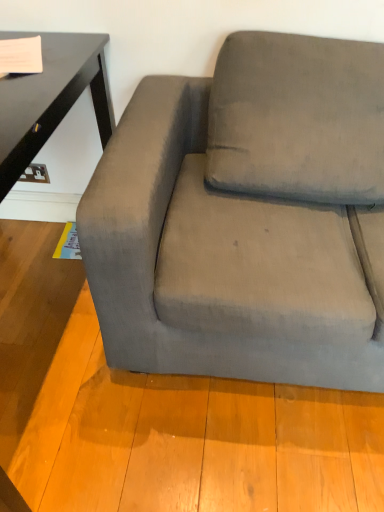
Question: From the image's perspective, would you say velvet gray couch at center is shown under suede-like gray pillow at upper right?

Choices:
 (A) yes
 (B) no

Answer: (A)

Question: Is velvet gray couch at center shorter than suede-like gray pillow at upper right?

Choices:
 (A) no
 (B) yes

Answer: (A)

Question: Considering the relative positions of velvet gray couch at center and suede-like gray pillow at upper right in the image provided, is velvet gray couch at center behind suede-like gray pillow at upper right?

Choices:
 (A) yes
 (B) no

Answer: (B)

Question: From a real-world perspective, is velvet gray couch at center on top of suede-like gray pillow at upper right?

Choices:
 (A) no
 (B) yes

Answer: (A)

Question: Does velvet gray couch at center have a lesser width compared to suede-like gray pillow at upper right?

Choices:
 (A) yes
 (B) no

Answer: (B)

Question: Can you confirm if velvet gray couch at center is smaller than suede-like gray pillow at upper right?

Choices:
 (A) no
 (B) yes

Answer: (A)

Question: Can you see suede-like gray pillow at upper right touching velvet gray couch at center?

Choices:
 (A) yes
 (B) no

Answer: (B)

Question: Is suede-like gray pillow at upper right facing towards velvet gray couch at center?

Choices:
 (A) yes
 (B) no

Answer: (A)

Question: Is suede-like gray pillow at upper right to the right of velvet gray couch at center from the viewer's perspective?

Choices:
 (A) no
 (B) yes

Answer: (B)

Question: Can you confirm if suede-like gray pillow at upper right is wider than velvet gray couch at center?

Choices:
 (A) no
 (B) yes

Answer: (A)

Question: From a real-world perspective, is suede-like gray pillow at upper right physically below velvet gray couch at center?

Choices:
 (A) yes
 (B) no

Answer: (B)

Question: Is suede-like gray pillow at upper right bigger than velvet gray couch at center?

Choices:
 (A) no
 (B) yes

Answer: (A)

Question: From a real-world perspective, relative to suede-like gray pillow at upper right, is velvet gray couch at center vertically above or below?

Choices:
 (A) below
 (B) above

Answer: (A)